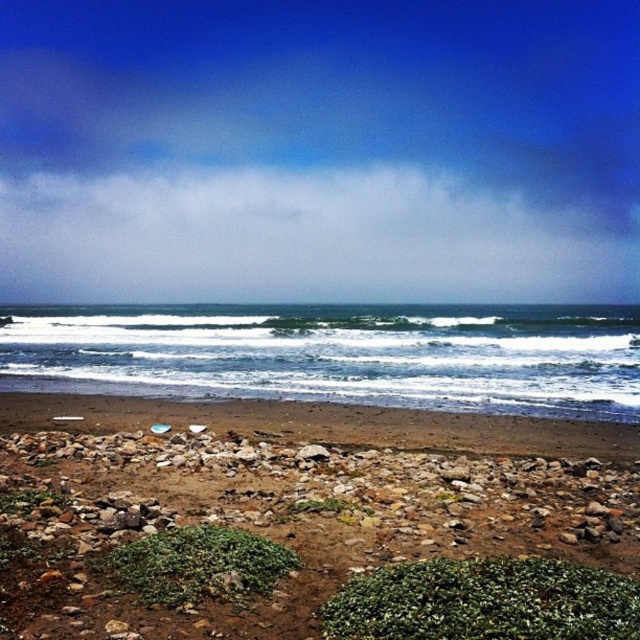
You are standing on the brown rocky beach at lower center and want to reach the blue ocean water at center. Which direction should you move to get there?

The brown rocky beach at lower center is below the blue ocean water at center, so you should move upward to reach the blue ocean water at center.

You are standing on the beach and want to reach the point marked at coordinates point (170, 518). If you walk straight ahead, how far will you have to walk to reach that point?

The point (170, 518) is 9.90 meters from the viewer, so you will have to walk 9.90 meters straight ahead to reach it.

You are planning to build a sandcastle on the beach. Given the image, which area would be more suitable for building a sandcastle between the brown rocky beach at lower center and the blue ocean water at center?

The blue ocean water at center occupies more space than the brown rocky beach at lower center, so the blue ocean water at center is more suitable for building a sandcastle since it has more space available.